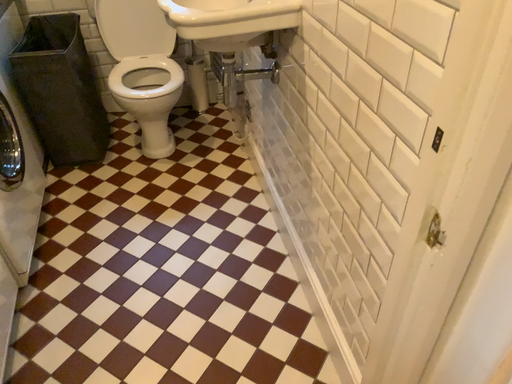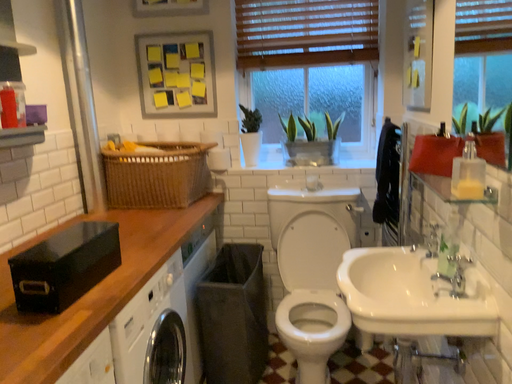
Question: Which way did the camera rotate in the video?

Choices:
 (A) rotated upward
 (B) rotated downward

Answer: (A)